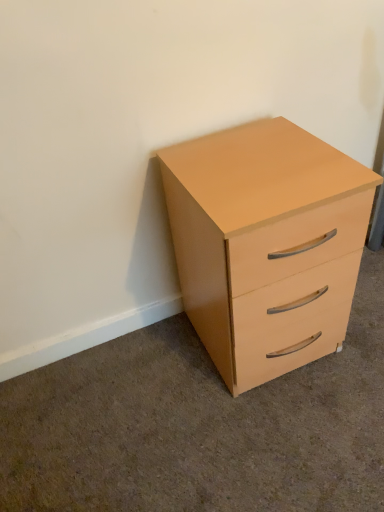
I want to click on matte wood chest of drawers at lower right, so click(x=260, y=232).

In order to face matte wood chest of drawers at lower right, should I rotate leftwards or rightwards?

Rotate right and turn 8.725 degrees.

Image resolution: width=384 pixels, height=512 pixels. What do you see at coordinates (260, 232) in the screenshot?
I see `matte wood chest of drawers at lower right` at bounding box center [260, 232].

In order to click on matte wood chest of drawers at lower right in this screenshot , I will do `click(260, 232)`.